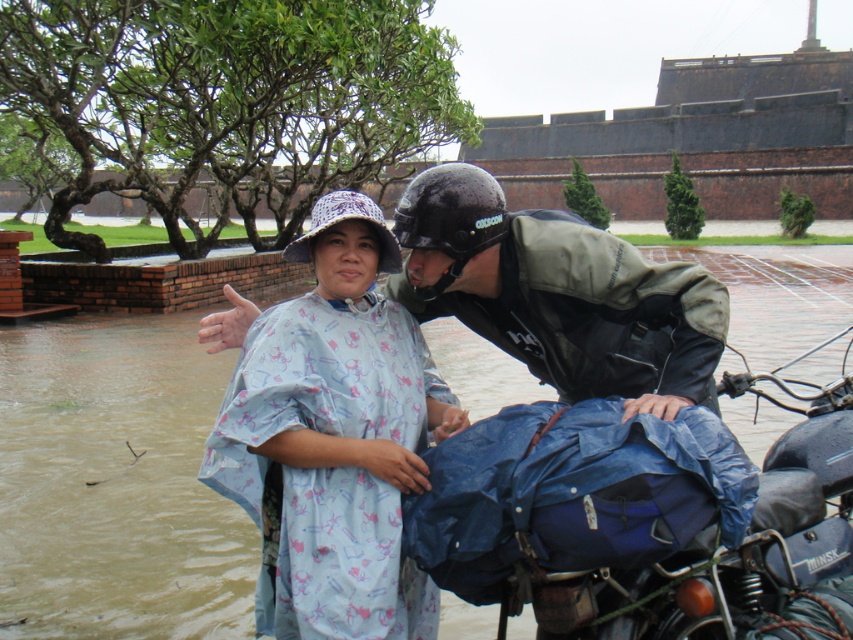
Question: Which point is farther from the camera taking this photo?

Choices:
 (A) 258,353
 (B) 680,337

Answer: (B)

Question: Which point is closer to the camera?

Choices:
 (A) light blue cotton dress at center
 (B) blue fabric-covered motorcycle at center

Answer: (A)

Question: Considering the relative positions of blue printed raincoat at center and light blue cotton dress at center in the image provided, where is blue printed raincoat at center located with respect to light blue cotton dress at center?

Choices:
 (A) above
 (B) below

Answer: (B)

Question: Which of these objects is positioned closest to the blue printed raincoat at center?

Choices:
 (A) blue fabric-covered motorcycle at center
 (B) light blue cotton dress at center

Answer: (B)

Question: Does blue printed raincoat at center appear on the right side of blue fabric-covered motorcycle at center?

Choices:
 (A) yes
 (B) no

Answer: (B)

Question: Is light blue cotton dress at center bigger than blue fabric-covered motorcycle at center?

Choices:
 (A) yes
 (B) no

Answer: (B)